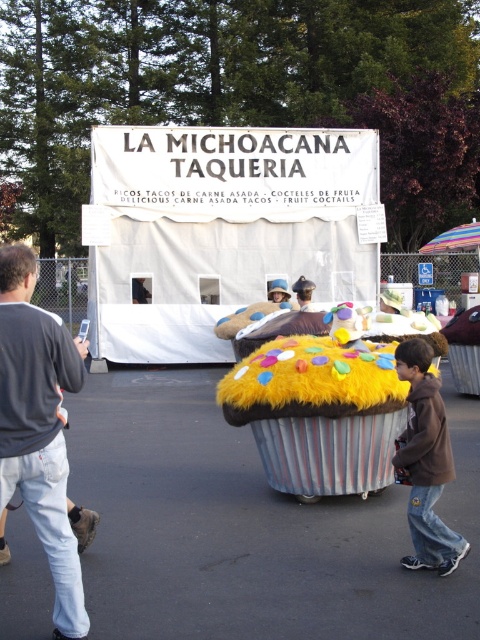
You are a customer at the LA MICHOCANA TAQUERIA food stand. You see a gray sweater at left and a brown fuzzy jacket at lower right. Which clothing item is closer to you?

The gray sweater at left is closer to you because it is in front of the brown fuzzy jacket at lower right.

You are a customer at the LA MICHOCANA TAQUERIA food stand. You see a gray sweater at left and a brown fuzzy jacket at lower right. Which clothing item is positioned closer to the left side of the scene?

The gray sweater at left is positioned closer to the left side of the scene than the brown fuzzy jacket at lower right.

You are a customer at the LA MICHOCANA TAQUERIA food stand and want to know the location of two specific points marked on the image. The first point is at coordinates point (34, 480) and the second is at point (423, 348). Which point is closer to the front of the stand?

Point (34, 480) is in front of point (423, 348), so the first point is closer to the front of the stand.